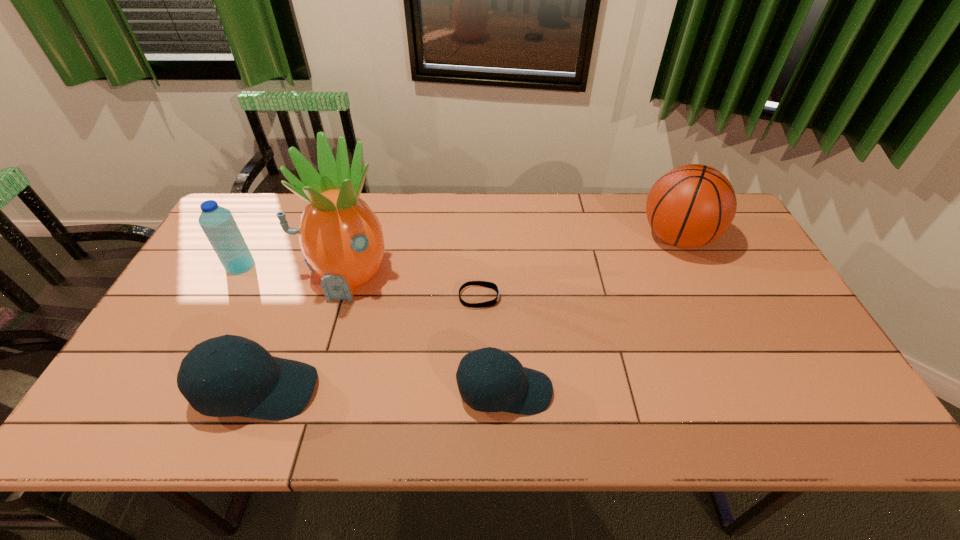
What are the coordinates of `vacant space at the right edge of the desktop` in the screenshot? It's located at pyautogui.click(x=785, y=302).

Locate an element on the screen. Image resolution: width=960 pixels, height=540 pixels. vacant space at the near left corner is located at coordinates (150, 366).

What are the coordinates of `vacant space that's between the basketball and the fifth tallest object` in the screenshot? It's located at (590, 315).

Where is `free spot between the taller baseball cap and the water bottle`? The height and width of the screenshot is (540, 960). free spot between the taller baseball cap and the water bottle is located at coordinates (250, 328).

You are a GUI agent. You are given a task and a screenshot of the screen. Output one action in this format:
    pyautogui.click(x=<x>, y=<y>)
    Task: Click on the empty space that is in between the basketball and the tallest object
    This screenshot has height=540, width=960.
    Given the screenshot: What is the action you would take?
    pyautogui.click(x=512, y=256)

This screenshot has width=960, height=540. I want to click on free point between the pineapple and the basketball, so tap(512, 256).

Image resolution: width=960 pixels, height=540 pixels. I want to click on empty space between the shorter baseball cap and the leftmost object, so click(x=372, y=328).

Where is `free space between the basketball and the wristband`? free space between the basketball and the wristband is located at coordinates (578, 268).

I want to click on vacant area that lies between the second shortest object and the pineapple, so click(x=425, y=333).

Identify which object is located as the second nearest to the pineapple. Please provide its 2D coordinates. Your answer should be formatted as a tuple, i.e. [(x, y)], where the tuple contains the x and y coordinates of a point satisfying the conditions above.

[(265, 387)]